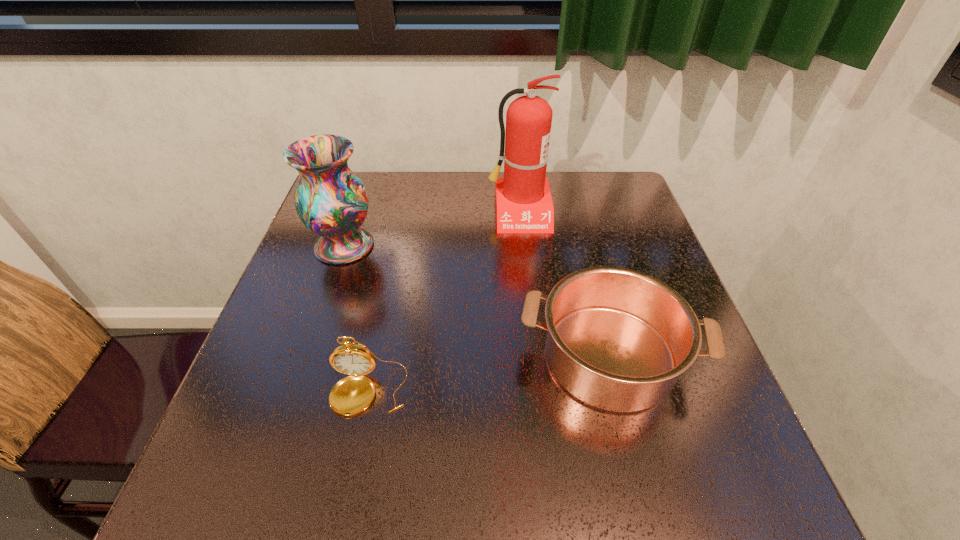
At what (x,y) coordinates should I click in order to perform the action: click on free space at the far edge. Please return your answer as a coordinate pair (x, y). This screenshot has height=540, width=960. Looking at the image, I should click on (574, 207).

The width and height of the screenshot is (960, 540). I want to click on vacant space at the near edge of the desktop, so click(x=305, y=483).

You are a GUI agent. You are given a task and a screenshot of the screen. Output one action in this format:
    pyautogui.click(x=<x>, y=<y>)
    Task: Click on the free space at the left edge of the desktop
    The width and height of the screenshot is (960, 540).
    Given the screenshot: What is the action you would take?
    pyautogui.click(x=309, y=346)

Image resolution: width=960 pixels, height=540 pixels. I want to click on vacant space at the right edge of the desktop, so 669,396.

You are a GUI agent. You are given a task and a screenshot of the screen. Output one action in this format:
    pyautogui.click(x=<x>, y=<y>)
    Task: Click on the vacant space that's between the third shortest object and the tallest object
    The image size is (960, 540).
    Given the screenshot: What is the action you would take?
    pyautogui.click(x=432, y=229)

Find the location of a particular element. The width and height of the screenshot is (960, 540). unoccupied position between the second tallest object and the tallest object is located at coordinates (432, 229).

Where is `unoccupied position between the pocket watch and the vase`? unoccupied position between the pocket watch and the vase is located at coordinates (356, 318).

In order to click on free spot between the saucepan and the pocket watch in this screenshot , I will do `click(489, 373)`.

Identify the location of vacant area that lies between the pocket watch and the saucepan. The width and height of the screenshot is (960, 540). (489, 373).

Locate an element on the screen. vacant point located between the vase and the pocket watch is located at coordinates (356, 318).